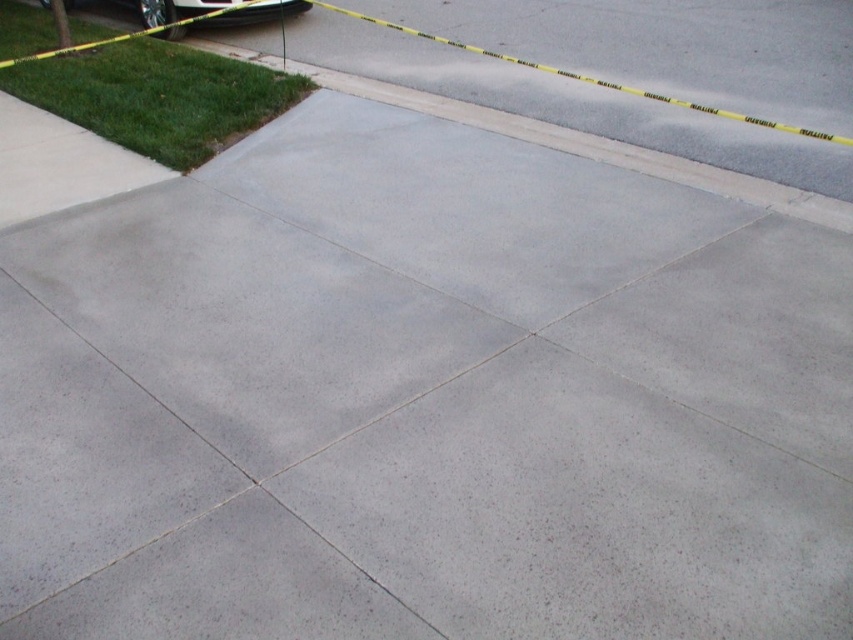
Consider the image. Is gray concrete curb at upper left shorter than shiny black car at upper left?

Incorrect, gray concrete curb at upper left's height does not fall short of shiny black car at upper left's.

Which of these two, gray concrete curb at upper left or shiny black car at upper left, stands taller?

gray concrete curb at upper left is taller.

At what (x,y) coordinates should I click in order to perform the action: click on gray concrete curb at upper left. Please return your answer as a coordinate pair (x, y). Looking at the image, I should click on (564, 140).